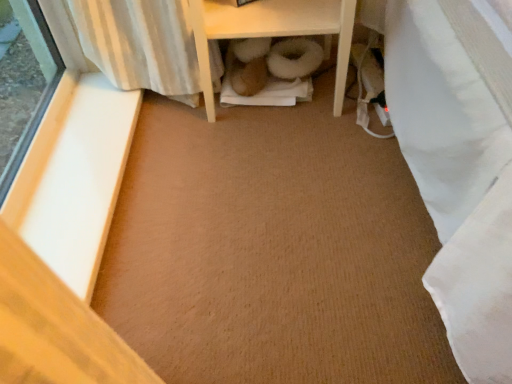
Question: In terms of size, does white wood shelf at center appear bigger or smaller than white smooth wood at left?

Choices:
 (A) big
 (B) small

Answer: (A)

Question: From the image's perspective, is white wood shelf at center located above or below white smooth wood at left?

Choices:
 (A) above
 (B) below

Answer: (A)

Question: Is point 219,21 closer or farther from the camera than point 89,278?

Choices:
 (A) farther
 (B) closer

Answer: (A)

Question: Considering the positions of white smooth wood at left and white wood shelf at center in the image, is white smooth wood at left bigger or smaller than white wood shelf at center?

Choices:
 (A) small
 (B) big

Answer: (A)

Question: Is white smooth wood at left to the left or to the right of white wood shelf at center in the image?

Choices:
 (A) right
 (B) left

Answer: (B)

Question: In terms of width, does white smooth wood at left look wider or thinner when compared to white wood shelf at center?

Choices:
 (A) thin
 (B) wide

Answer: (A)

Question: From the image's perspective, is white smooth wood at left located above or below white wood shelf at center?

Choices:
 (A) above
 (B) below

Answer: (B)